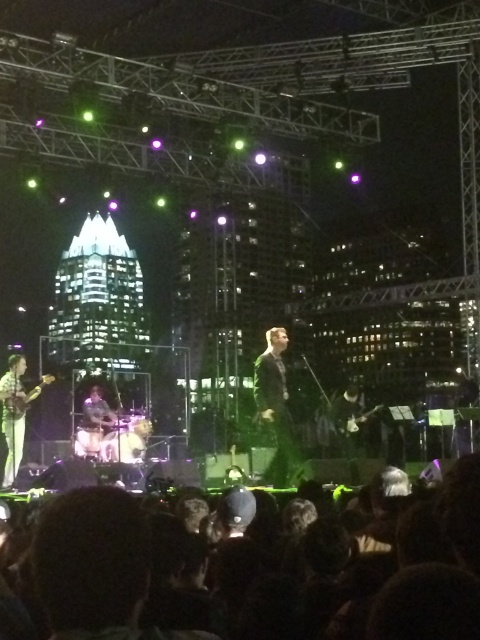
Question: Can you confirm if dark hair at lower center is positioned below shiny silver guitar at left?

Choices:
 (A) no
 (B) yes

Answer: (B)

Question: Is dark hair at lower center below shiny silver guitar at left?

Choices:
 (A) no
 (B) yes

Answer: (B)

Question: Which point is farther to the camera?

Choices:
 (A) shiny silver guitar at left
 (B) dark hair at lower center

Answer: (A)

Question: Which point is farther to the camera?

Choices:
 (A) shiny silver guitar at left
 (B) dark hair at lower center

Answer: (A)

Question: Does dark hair at lower center have a lesser width compared to shiny silver guitar at left?

Choices:
 (A) yes
 (B) no

Answer: (B)